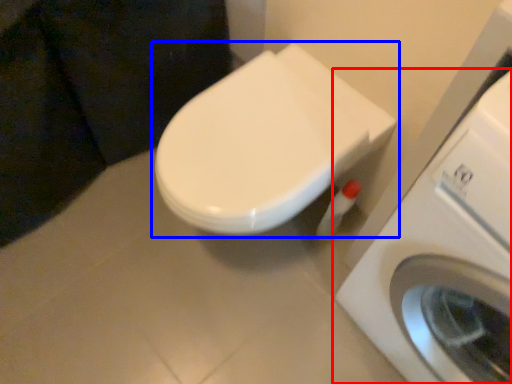
Question: Which object appears farthest to the camera in this image, washing machine (highlighted by a red box) or toilet (highlighted by a blue box)?

Choices:
 (A) washing machine
 (B) toilet

Answer: (B)